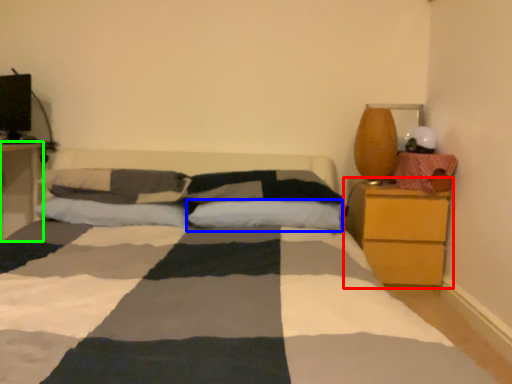
Question: Considering the real-world distances, which object is closest to nightstand (highlighted by a red box)? pillow (highlighted by a blue box) or nightstand (highlighted by a green box).

Choices:
 (A) pillow
 (B) nightstand

Answer: (A)